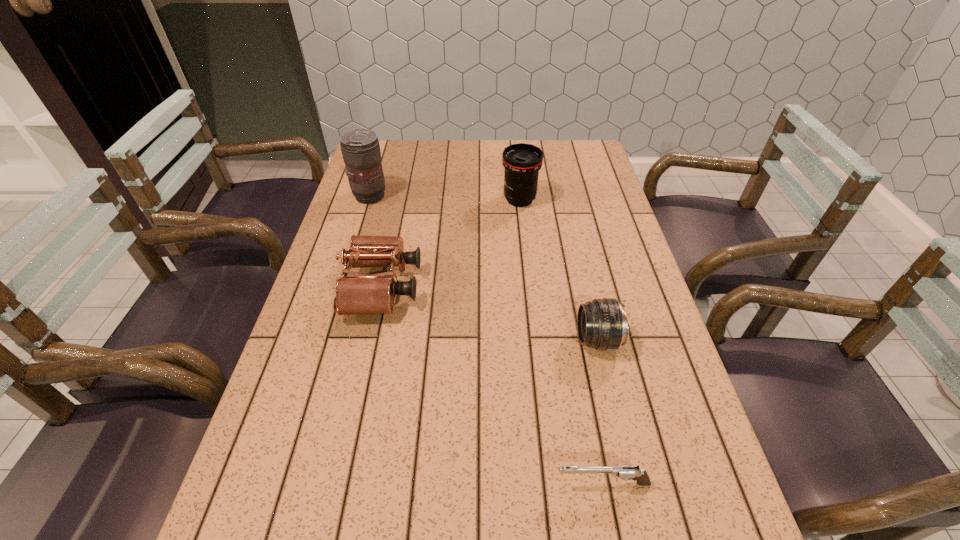
Where is `telephoto lens that is at the right edge`? The height and width of the screenshot is (540, 960). telephoto lens that is at the right edge is located at coordinates (602, 324).

The image size is (960, 540). I want to click on pistol present at the right edge, so click(625, 472).

The image size is (960, 540). In the image, there is a desktop. Identify the location of vacant space at the far edge. (496, 159).

Locate an element on the screen. free space at the left edge of the desktop is located at coordinates (320, 326).

This screenshot has height=540, width=960. Find the location of `free space at the right edge of the desktop`. free space at the right edge of the desktop is located at coordinates (660, 426).

In the image, there is a desktop. Identify the location of vacant region at the far left corner. (402, 146).

Find the location of a particular element. The image size is (960, 540). vacant area that lies between the fourth shortest object and the nearest telephoto lens is located at coordinates (559, 270).

The height and width of the screenshot is (540, 960). Identify the location of free space between the binoculars and the shortest telephoto lens. (490, 313).

Find the location of a particular element. This screenshot has height=540, width=960. empty space that is in between the second telephoto lens from left to right and the tallest object is located at coordinates (445, 198).

Where is `vacant region between the shortest telephoto lens and the nearest object`? vacant region between the shortest telephoto lens and the nearest object is located at coordinates (600, 411).